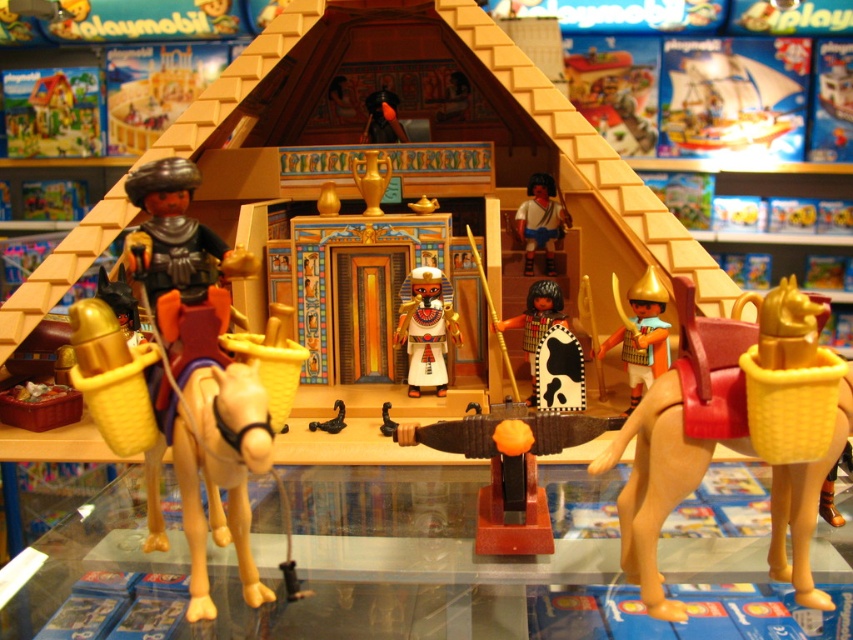
Is matte gold pharaoh at center to the right of cowhide shield at center from the viewer's perspective?

In fact, matte gold pharaoh at center is to the left of cowhide shield at center.

The height and width of the screenshot is (640, 853). Describe the element at coordinates (426, 326) in the screenshot. I see `matte gold pharaoh at center` at that location.

I want to click on matte gold pharaoh at center, so click(x=426, y=326).

Can you confirm if matte gold pharaoh at center is shorter than gold metallic helmet at right?

Correct, matte gold pharaoh at center is not as tall as gold metallic helmet at right.

Which is in front, point (442, 330) or point (648, 337)?

Point (648, 337)

Where is `matte gold pharaoh at center`? matte gold pharaoh at center is located at coordinates (426, 326).

Based on the photo, is tan matte camel at right wider than white matte figure at center?

Correct, the width of tan matte camel at right exceeds that of white matte figure at center.

Is point (825, 461) more distant than point (552, 204)?

No, it is in front of (552, 204).

Find the location of a particular element. The height and width of the screenshot is (640, 853). tan matte camel at right is located at coordinates click(680, 433).